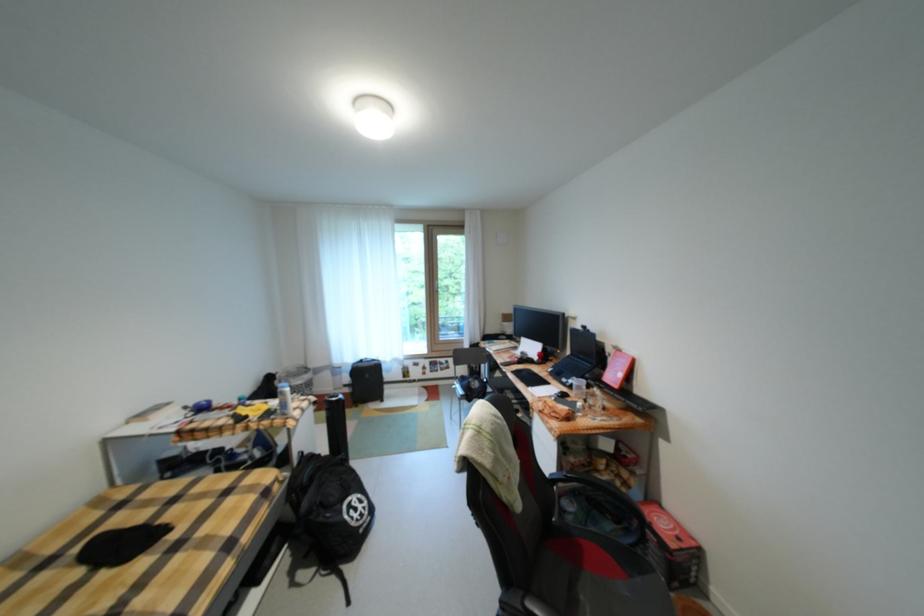
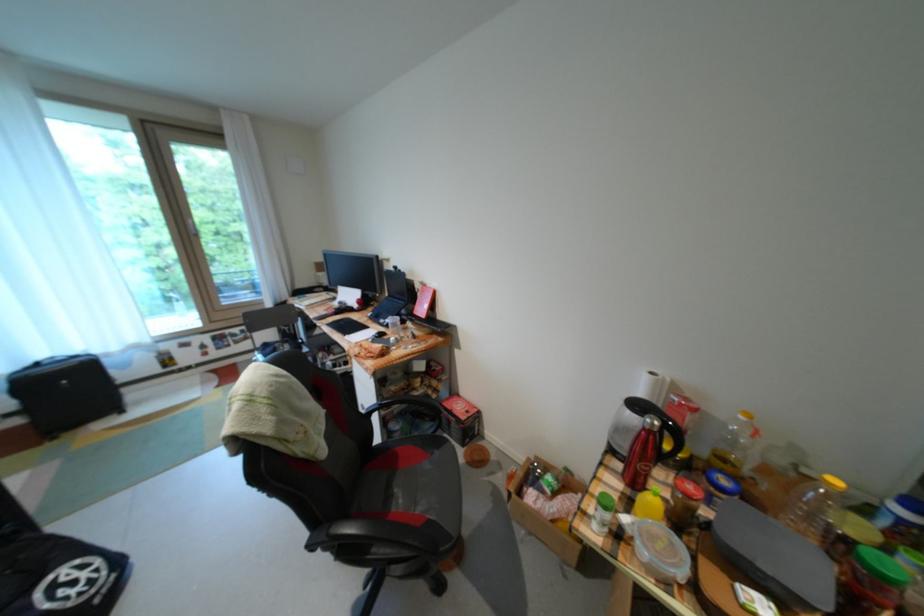
The point at [444,284] is marked in the first image. Where is the corresponding point in the second image?

(195, 223)